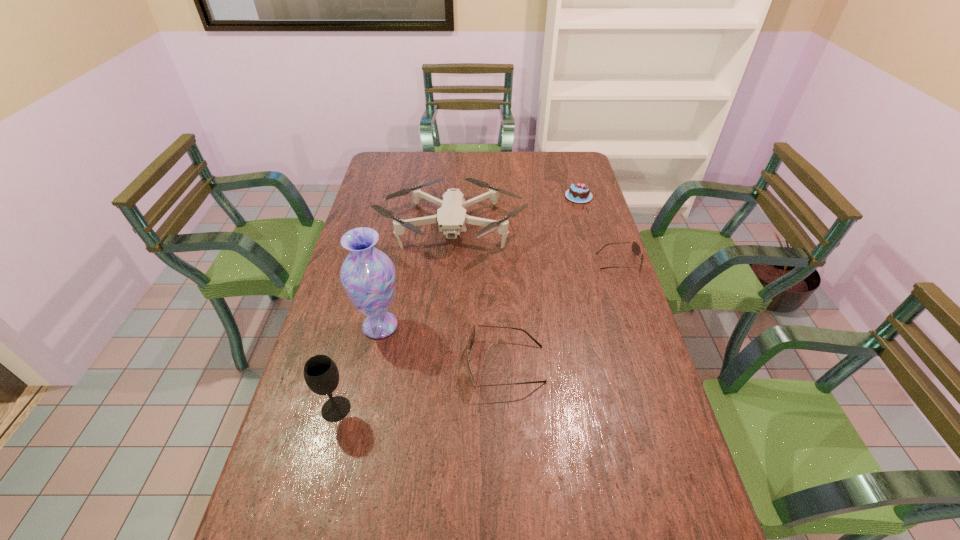
You are a GUI agent. You are given a task and a screenshot of the screen. Output one action in this format:
    pyautogui.click(x=<x>, y=<y>)
    Task: Click on the blank region between the nearer sunglasses and the vase
    
    Given the screenshot: What is the action you would take?
    pyautogui.click(x=443, y=345)

Locate an element on the screen. vacant area that lies between the vase and the fifth shortest object is located at coordinates (358, 367).

Locate an element on the screen. This screenshot has width=960, height=540. unoccupied area between the chocolate cake and the wineglass is located at coordinates (457, 302).

The image size is (960, 540). In order to click on unoccupied area between the drone and the third shortest object in this screenshot , I will do `click(478, 295)`.

Where is `empty location between the fifth shortest object and the nearer sunglasses`? This screenshot has width=960, height=540. empty location between the fifth shortest object and the nearer sunglasses is located at coordinates (420, 387).

Where is `empty space between the shorter sunglasses and the fifth shortest object`? The width and height of the screenshot is (960, 540). empty space between the shorter sunglasses and the fifth shortest object is located at coordinates (477, 335).

The image size is (960, 540). I want to click on the fourth closest object to the taller sunglasses, so click(x=636, y=249).

You are a GUI agent. You are given a task and a screenshot of the screen. Output one action in this format:
    pyautogui.click(x=<x>, y=<y>)
    Task: Click on the object that is the third closest to the vase
    The height and width of the screenshot is (540, 960).
    Given the screenshot: What is the action you would take?
    pyautogui.click(x=451, y=217)

Identify the location of free location that satisfies the following two spatial constraints: 1. on the front-facing side of the right sunglasses; 2. on the front side of the vase. Image resolution: width=960 pixels, height=540 pixels. (640, 326).